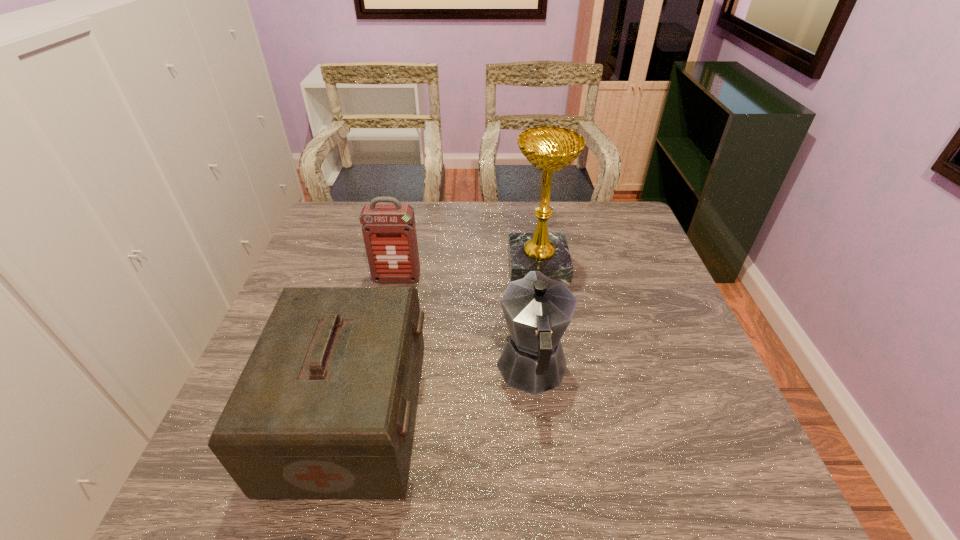
Identify which object is the closest to the nearer first-aid kit. Please provide its 2D coordinates. Your answer should be formatted as a tuple, i.e. [(x, y)], where the tuple contains the x and y coordinates of a point satisfying the conditions above.

[(538, 310)]

Locate an element on the screen. vacant area that satisfies the following two spatial constraints: 1. on the front-facing side of the award; 2. on the front-facing side of the farther first-aid kit is located at coordinates (540, 279).